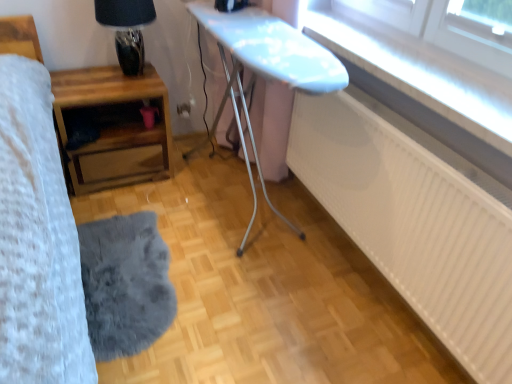
Where is `vacant space underneath matte glass table lamp at upper left (from a real-world perspective)`? The width and height of the screenshot is (512, 384). vacant space underneath matte glass table lamp at upper left (from a real-world perspective) is located at coordinates (126, 79).